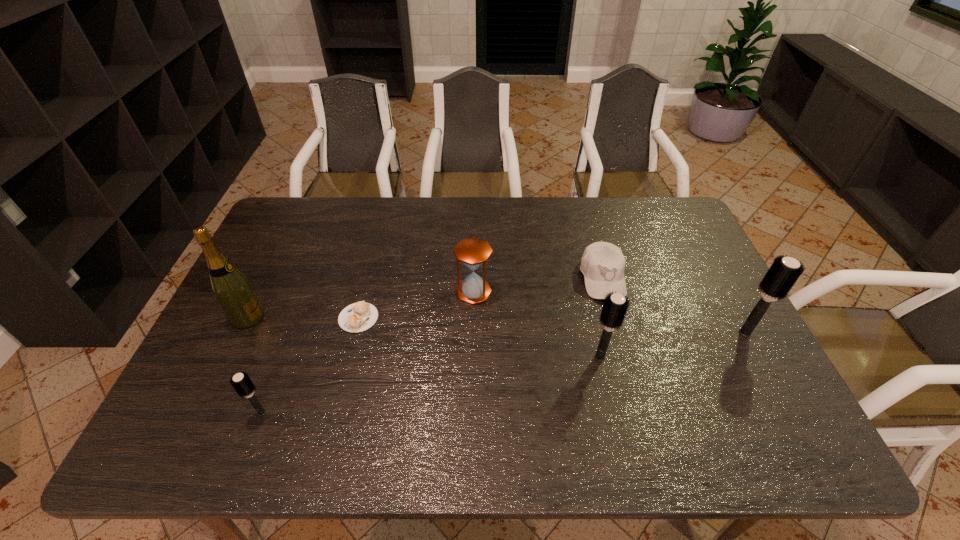
Image resolution: width=960 pixels, height=540 pixels. Find the location of `hairbrush that stands as the second closest to the second shortest object`. hairbrush that stands as the second closest to the second shortest object is located at coordinates (784, 272).

I want to click on vacant space that satisfies the following two spatial constraints: 1. on the front side of the second hairbrush from left to right; 2. on the left side of the hourglass, so click(x=472, y=357).

Identify the location of vacant region that satisfies the following two spatial constraints: 1. on the front-facing side of the baseball cap; 2. on the front-facing side of the wine bottle. (613, 317).

Identify the location of vacant space that satisfies the following two spatial constraints: 1. on the front-facing side of the sixth tallest object; 2. on the front-facing side of the wine bottle. The width and height of the screenshot is (960, 540). [613, 317].

In order to click on free space that satisfies the following two spatial constraints: 1. on the front-facing side of the farthest hairbrush; 2. on the right side of the baseball cap in this screenshot , I will do `click(617, 333)`.

You are a GUI agent. You are given a task and a screenshot of the screen. Output one action in this format:
    pyautogui.click(x=<x>, y=<y>)
    Task: Click on the free space that satisfies the following two spatial constraints: 1. on the front-facing side of the tallest object; 2. on the back side of the fifth object from right to left
    Image resolution: width=960 pixels, height=540 pixels.
    Given the screenshot: What is the action you would take?
    pyautogui.click(x=248, y=318)